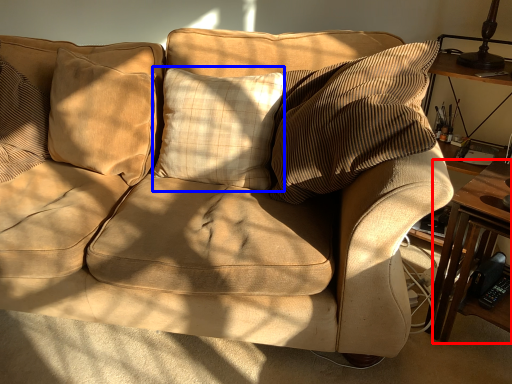
Question: Among these objects, which one is nearest to the camera, table (highlighted by a red box) or pillow (highlighted by a blue box)?

Choices:
 (A) table
 (B) pillow

Answer: (A)